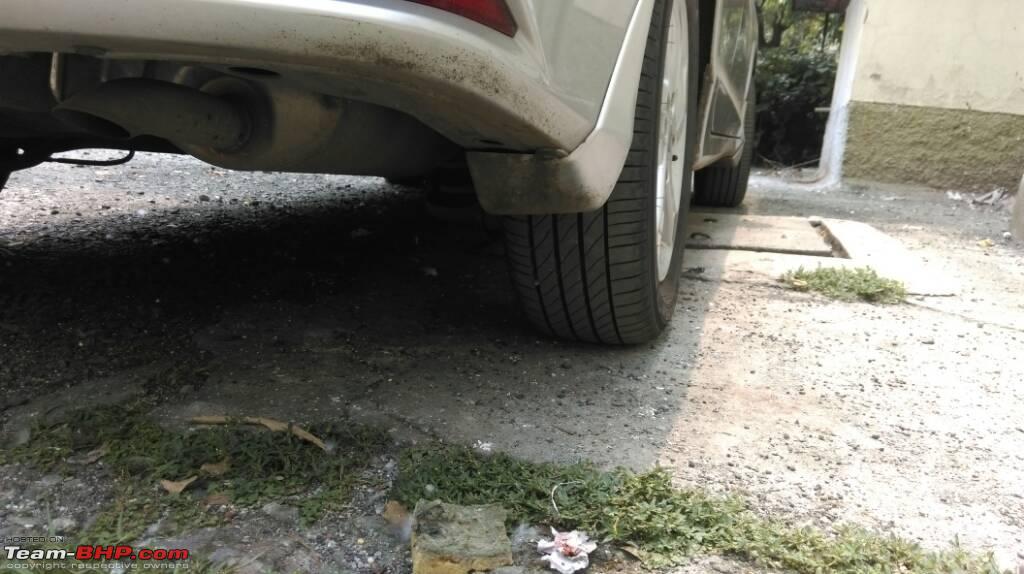
Locate an element on the screen. The image size is (1024, 574). rug is located at coordinates (785, 244).